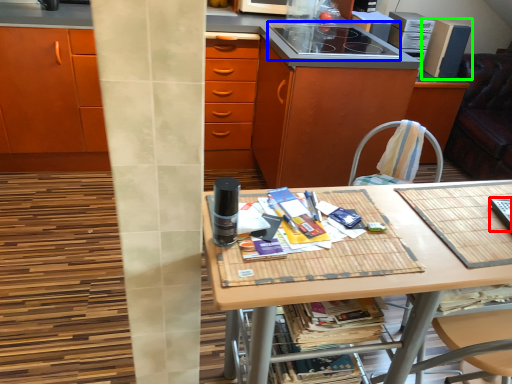
Question: Estimate the real-world distances between objects in this image. Which object is farther from appliance (highlighted by a red box), appliance (highlighted by a blue box) or kitchen appliance (highlighted by a green box)?

Choices:
 (A) appliance
 (B) kitchen appliance

Answer: (B)